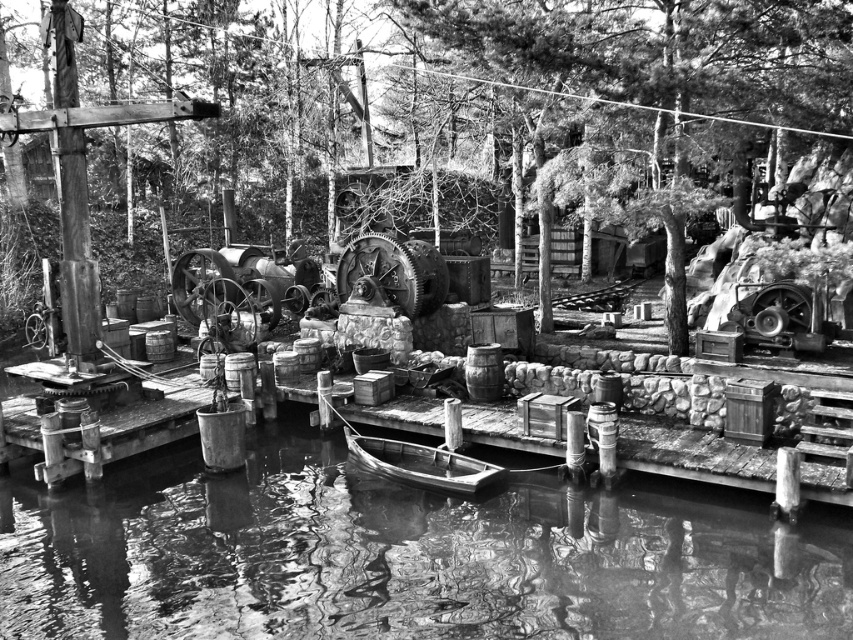
Is smooth water at center positioned before wooden raft at center?

Yes, smooth water at center is in front of wooden raft at center.

Is smooth water at center smaller than wooden raft at center?

No, smooth water at center is not smaller than wooden raft at center.

What do you see at coordinates (402, 556) in the screenshot?
I see `smooth water at center` at bounding box center [402, 556].

This screenshot has height=640, width=853. What are the coordinates of `smooth water at center` in the screenshot? It's located at (402, 556).